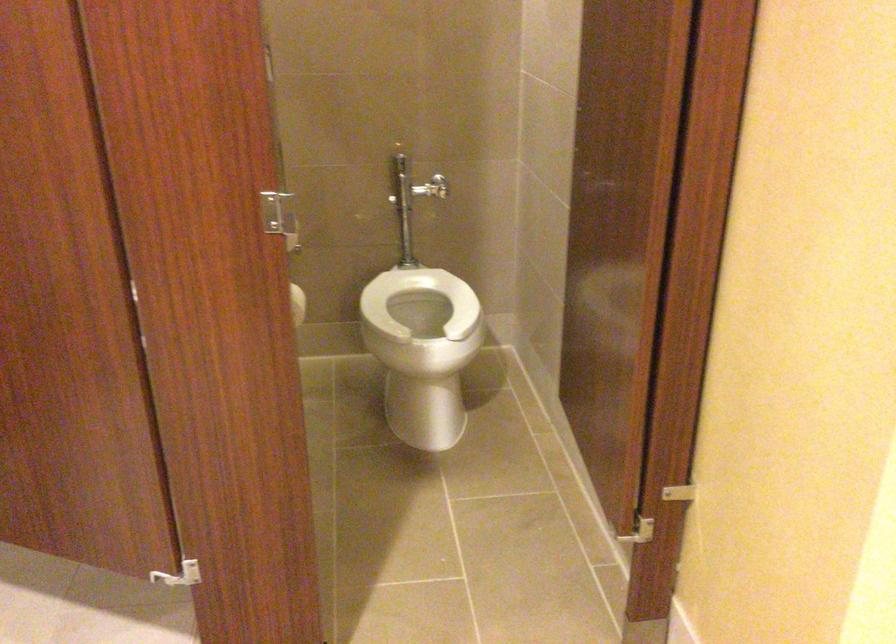
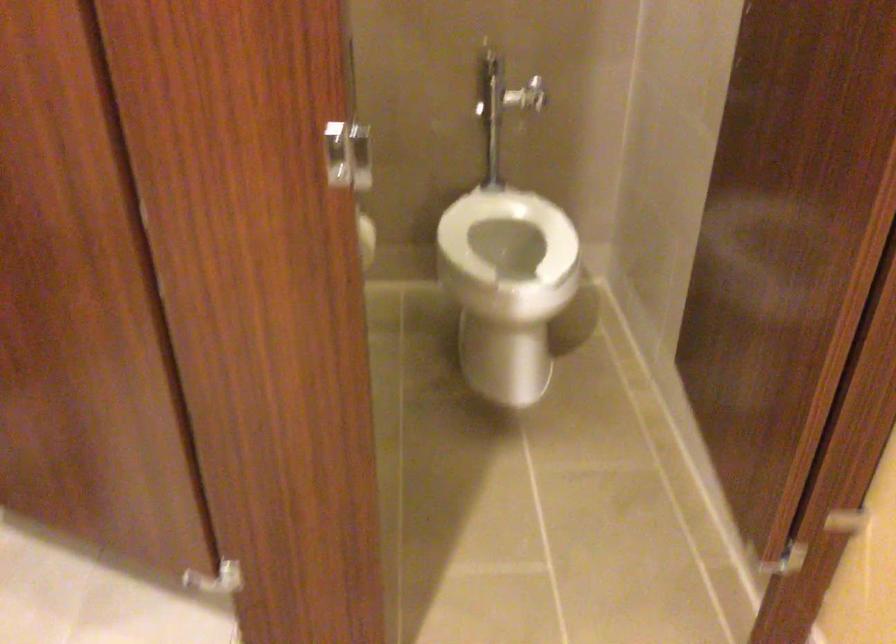
Question: The images are taken continuously from a first-person perspective. In which direction is your viewpoint rotating?

Choices:
 (A) Left
 (B) Right
 (C) Up
 (D) Down

Answer: (D)